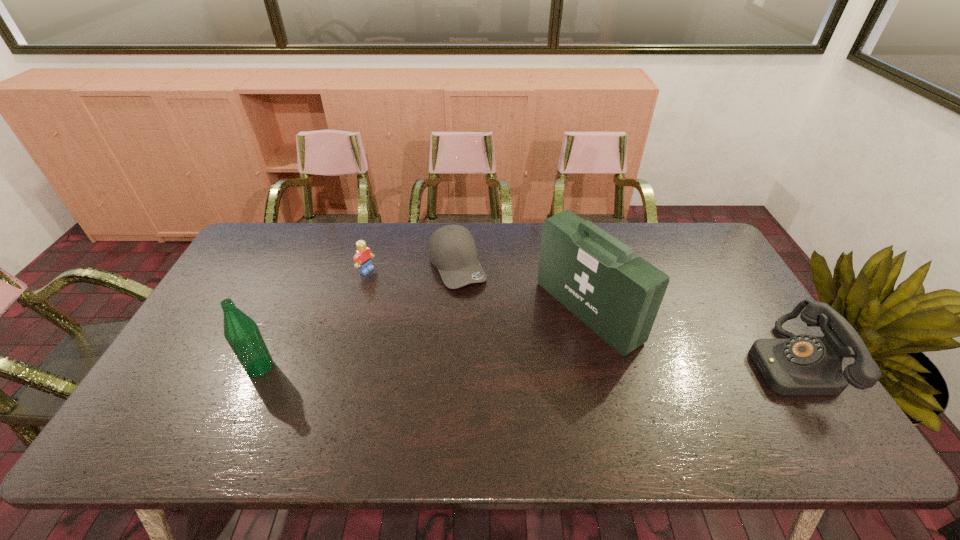
This screenshot has width=960, height=540. I want to click on free spot on the desktop that is between the bottle and the third tallest object and is positioned on the front-facing side of the first-aid kit, so click(492, 366).

Locate an element on the screen. This screenshot has height=540, width=960. free space on the desktop that is between the bottle and the rightmost object and is positioned on the front brim of the third object from left to right is located at coordinates (516, 366).

The width and height of the screenshot is (960, 540). I want to click on vacant space on the desktop that is between the leftmost object and the rightmost object and is positioned on the front-facing side of the Lego, so pyautogui.click(x=538, y=366).